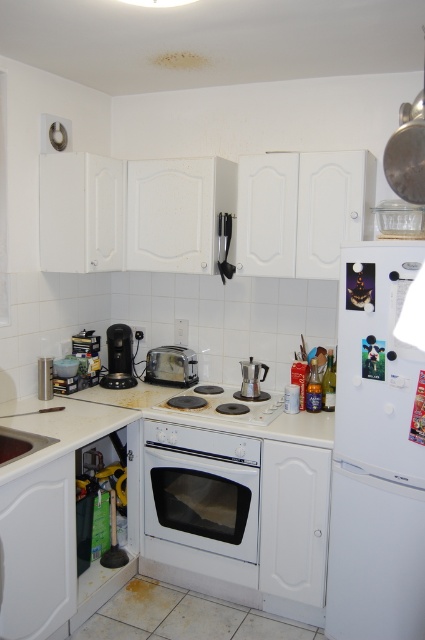
Question: Does white glossy countertop at center appear on the right side of white ceramic sink at lower left?

Choices:
 (A) no
 (B) yes

Answer: (B)

Question: Estimate the real-world distances between objects in this image. Which object is closer to the white glossy oven at center?

Choices:
 (A) silver metallic toaster at center
 (B) white ceramic sink at lower left
 (C) black plastic coffee machine at lower left
 (D) satin silver coffee maker at center

Answer: (D)

Question: Can you confirm if white glossy oven at center is smaller than white glossy countertop at center?

Choices:
 (A) yes
 (B) no

Answer: (A)

Question: Based on their relative distances, which object is farther from the white glossy oven at center?

Choices:
 (A) white glossy countertop at center
 (B) white matte refrigerator at right
 (C) satin silver coffee maker at center

Answer: (B)

Question: Which of the following is the farthest from the observer?

Choices:
 (A) satin silver coffee maker at center
 (B) black plastic coffee machine at lower left
 (C) white matte refrigerator at right

Answer: (B)

Question: Is white matte refrigerator at right above black plastic coffee machine at lower left?

Choices:
 (A) yes
 (B) no

Answer: (B)